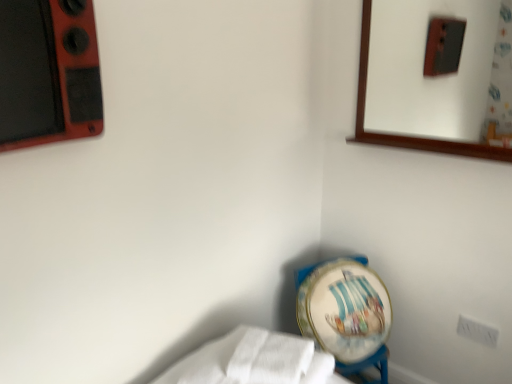
Question: In terms of width, does white fabric at lower left look wider or thinner when compared to painted ceramic globe at lower center?

Choices:
 (A) wide
 (B) thin

Answer: (A)

Question: In terms of size, does white fabric at lower left appear bigger or smaller than painted ceramic globe at lower center?

Choices:
 (A) small
 (B) big

Answer: (A)

Question: Which of these objects is positioned farthest from the white fabric at lower left?

Choices:
 (A) painted ceramic globe at lower center
 (B) wooden-framed mirror at upper right
 (C) white plastic electric outlet at lower right

Answer: (B)

Question: Which object is positioned farthest from the painted ceramic globe at lower center?

Choices:
 (A) white plastic electric outlet at lower right
 (B) white fabric at lower left
 (C) wooden-framed mirror at upper right

Answer: (C)